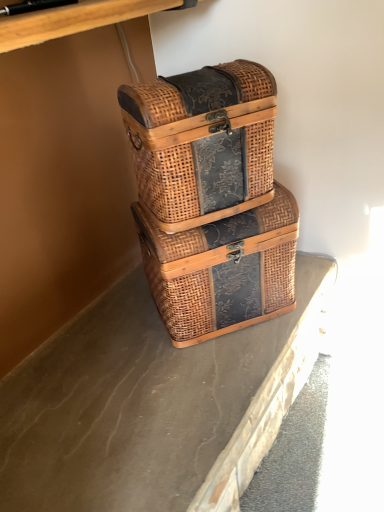
Question: From the image's perspective, is brown textured concrete at center positioned above or below woven wood picnic basket at center, which is the second picnic basket in bottom-to-top order?

Choices:
 (A) below
 (B) above

Answer: (A)

Question: Considering the positions of brown textured concrete at center and woven wood picnic basket at center, which is the second picnic basket in bottom-to-top order, in the image, is brown textured concrete at center bigger or smaller than woven wood picnic basket at center, which is the second picnic basket in bottom-to-top order,?

Choices:
 (A) big
 (B) small

Answer: (B)

Question: Estimate the real-world distances between objects in this image. Which object is farther from the brown textured concrete at center?

Choices:
 (A) woven wood picnic basket at center, arranged as the first picnic basket when viewed from the top
 (B) woven brown picnic basket at center, acting as the 1th picnic basket starting from the bottom

Answer: (A)

Question: Based on their relative distances, which object is farther from the brown textured concrete at center?

Choices:
 (A) woven brown picnic basket at center, which is the second picnic basket in top-to-bottom order
 (B) woven wood picnic basket at center, arranged as the first picnic basket when viewed from the top

Answer: (B)